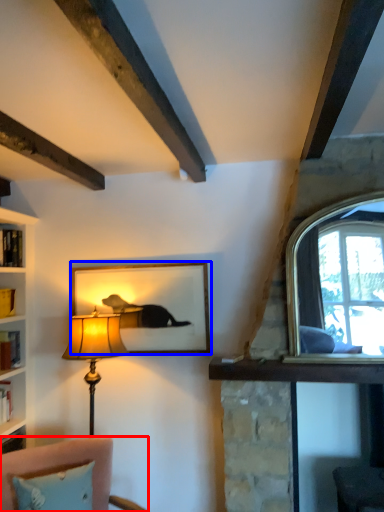
Question: Which object appears closest to the camera in this image, furniture (highlighted by a red box) or picture frame (highlighted by a blue box)?

Choices:
 (A) furniture
 (B) picture frame

Answer: (A)